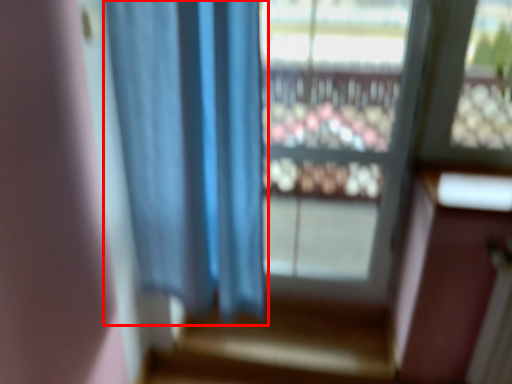
Question: In this image, where is curtain (annotated by the red box) located relative to window?

Choices:
 (A) left
 (B) right

Answer: (A)